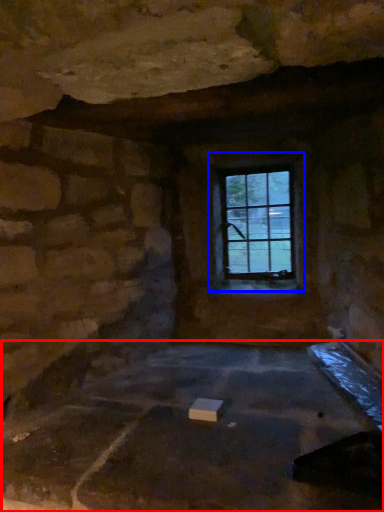
Question: Which object is further to the camera taking this photo, foundation (highlighted by a red box) or window (highlighted by a blue box)?

Choices:
 (A) foundation
 (B) window

Answer: (B)